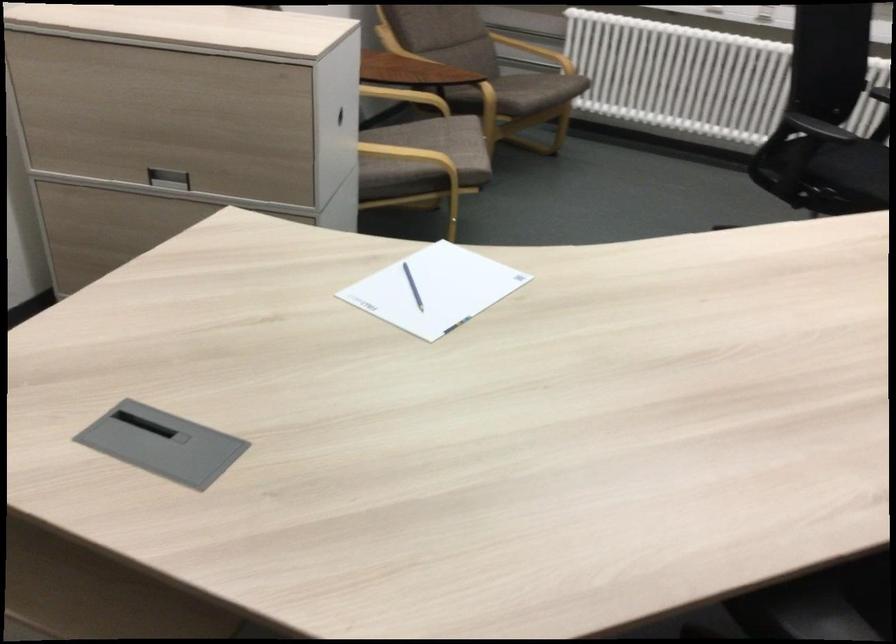
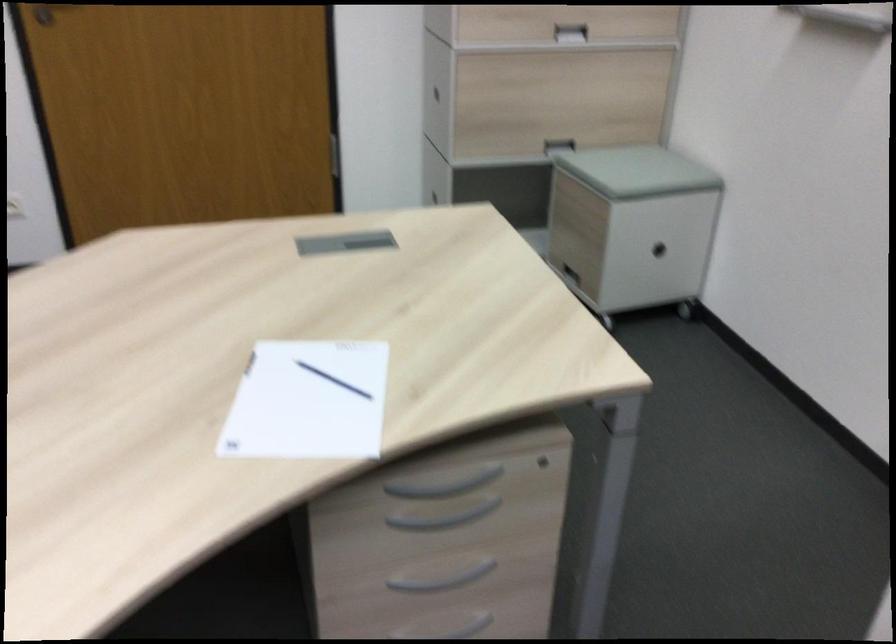
Locate, in the second image, the point that corresponds to pixel 429 295 in the first image.

(307, 402)